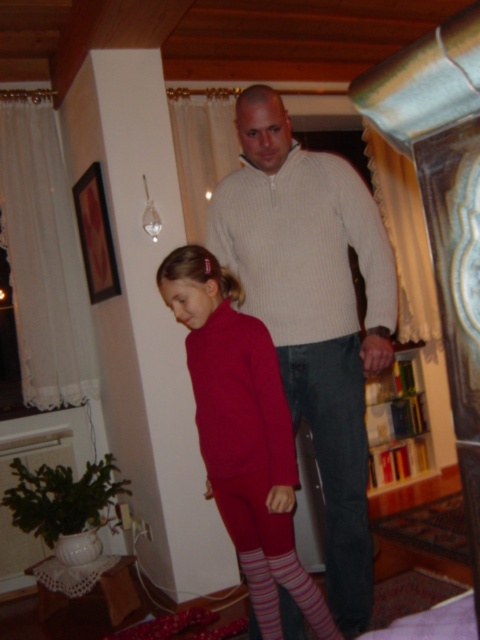
Is knitted beige sweater at center to the left of pink striped sock at lower center from the viewer's perspective?

In fact, knitted beige sweater at center is to the right of pink striped sock at lower center.

At what (x,y) coordinates should I click in order to perform the action: click on knitted beige sweater at center. Please return your answer as a coordinate pair (x, y). Looking at the image, I should click on (313, 312).

Locate an element on the screen. knitted beige sweater at center is located at coordinates (313, 312).

Can you confirm if matte red sweater at center is wider than striped cotton sock at lower center?

Correct, the width of matte red sweater at center exceeds that of striped cotton sock at lower center.

Is matte red sweater at center in front of striped cotton sock at lower center?

Yes, it is.

Does point (232, 433) come farther from viewer compared to point (248, 588)?

No, it is in front of (248, 588).

You are a GUI agent. You are given a task and a screenshot of the screen. Output one action in this format:
    pyautogui.click(x=<x>, y=<y>)
    Task: Click on the matte red sweater at center
    The image size is (480, 640).
    Given the screenshot: What is the action you would take?
    pyautogui.click(x=242, y=433)

Consider the image. Does matte red sweater at center have a smaller size compared to pink striped sock at lower center?

No.

Can you confirm if matte red sweater at center is shorter than pink striped sock at lower center?

No.

Describe the element at coordinates (242, 433) in the screenshot. I see `matte red sweater at center` at that location.

At what (x,y) coordinates should I click in order to perform the action: click on matte red sweater at center. Please return your answer as a coordinate pair (x, y). Looking at the image, I should click on (242, 433).